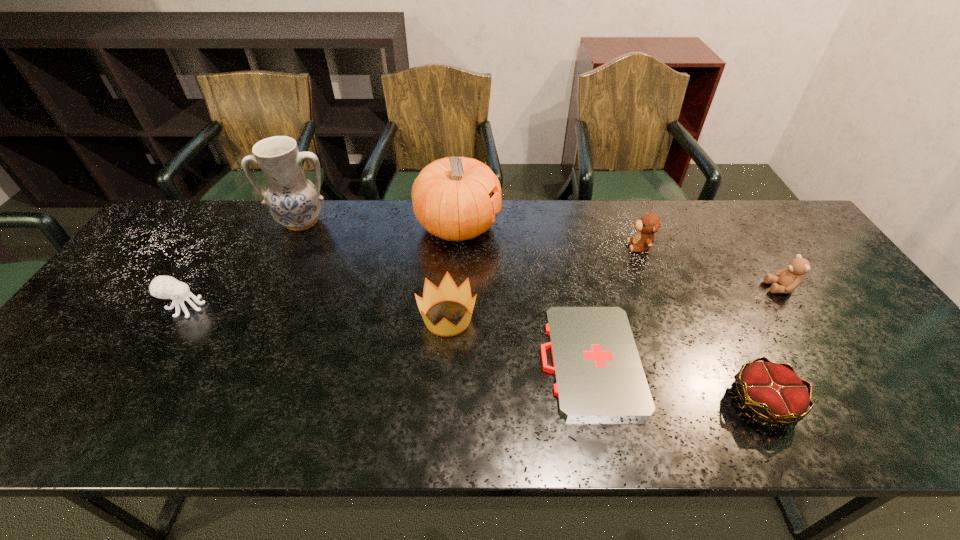
Find the location of a particular element. The image size is (960, 540). free space located 0.240m on the face of the nearer teddy bear is located at coordinates (679, 288).

Locate an element on the screen. blank space located on the face of the nearer teddy bear is located at coordinates (675, 288).

You are a GUI agent. You are given a task and a screenshot of the screen. Output one action in this format:
    pyautogui.click(x=<x>, y=<y>)
    Task: Click on the free space located 0.250m on the front of the left crown
    The height and width of the screenshot is (540, 960).
    Given the screenshot: What is the action you would take?
    pyautogui.click(x=440, y=441)

In order to click on free location located 0.120m on the right of the right crown in this screenshot , I will do `click(850, 403)`.

Image resolution: width=960 pixels, height=540 pixels. Identify the location of vacant area located 0.340m on handle side the first-aid kit. (397, 360).

This screenshot has height=540, width=960. I want to click on vacant space situated 0.280m on handle side the first-aid kit, so click(422, 360).

At what (x,y) coordinates should I click in order to perform the action: click on vacant region located 0.160m on handle side the first-aid kit. Please return your answer as a coordinate pair (x, y). Looking at the image, I should click on (473, 360).

What are the coordinates of `pottery located at the far edge` in the screenshot? It's located at tap(295, 202).

This screenshot has width=960, height=540. What are the coordinates of `pumpkin positioned at the far edge` in the screenshot? It's located at (451, 196).

Where is `teddy bear at the far edge`? This screenshot has width=960, height=540. teddy bear at the far edge is located at coordinates (650, 223).